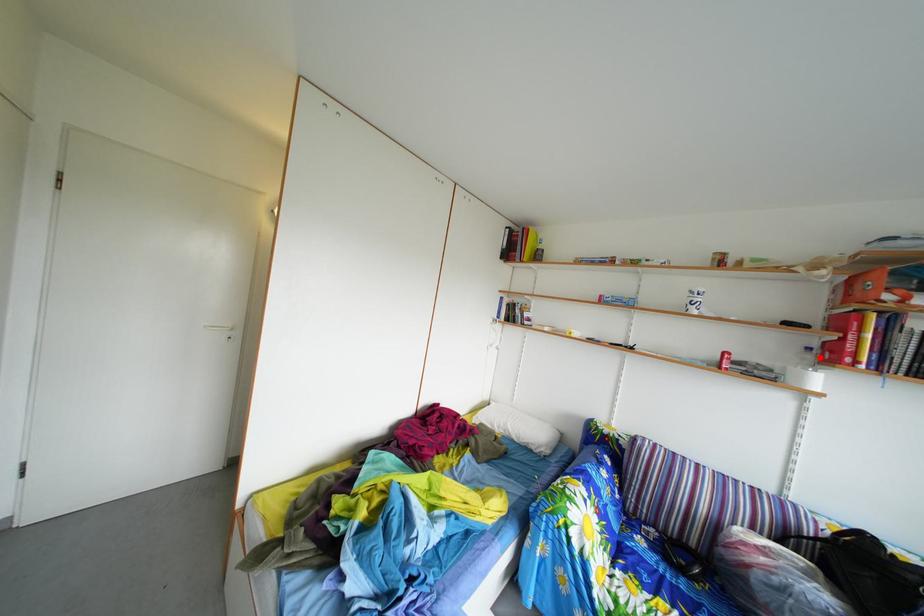
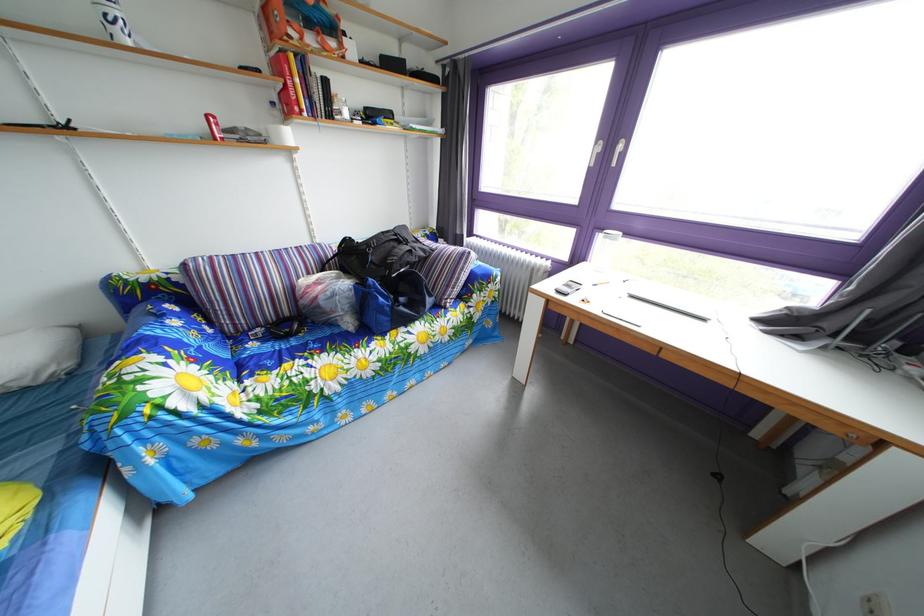
Locate, in the second image, the point that corresponds to the highlighted location in the first image.

(284, 111)